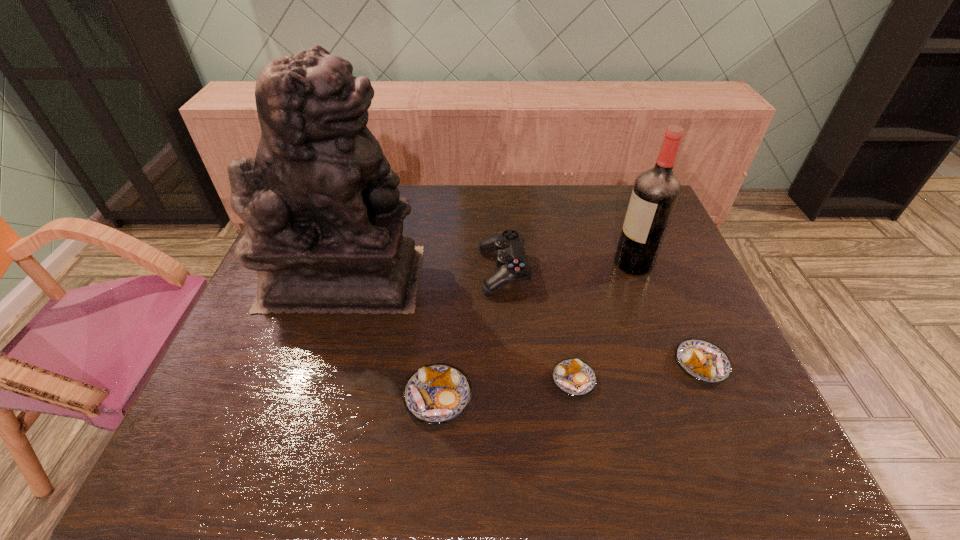
Where is `pastry at the right edge`? pastry at the right edge is located at coordinates (702, 360).

Locate an element on the screen. liquor present at the right edge is located at coordinates (656, 191).

Where is `object present at the near right corner`? Image resolution: width=960 pixels, height=540 pixels. object present at the near right corner is located at coordinates (702, 360).

I want to click on free space at the far edge of the desktop, so click(x=600, y=201).

Identify the location of vacant area at the near edge. The image size is (960, 540). (633, 408).

In order to click on free space at the left edge of the desktop in this screenshot , I will do `click(228, 353)`.

Identify the location of free space at the right edge. (695, 283).

This screenshot has height=540, width=960. In order to click on vacant space at the far right corner in this screenshot , I will do `click(619, 188)`.

The height and width of the screenshot is (540, 960). In the image, there is a desktop. What are the coordinates of `vacant space at the near right corner` in the screenshot? It's located at (709, 391).

At what (x,y) coordinates should I click in order to perform the action: click on vacant point located between the liquor and the leftmost object. Please return your answer as a coordinate pair (x, y). This screenshot has width=960, height=540. Looking at the image, I should click on (489, 271).